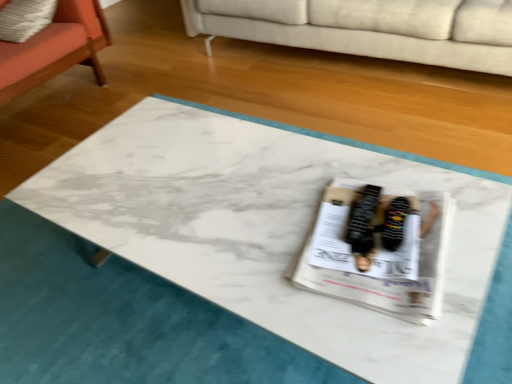
Where is `vacant area that is in front of black suede sneakers at center`? vacant area that is in front of black suede sneakers at center is located at coordinates (411, 288).